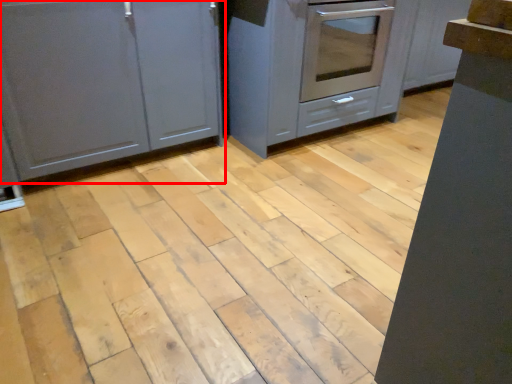
Question: From the image's perspective, what is the correct spatial positioning of cabinetry (annotated by the red box) in reference to cabinetry?

Choices:
 (A) below
 (B) above

Answer: (A)